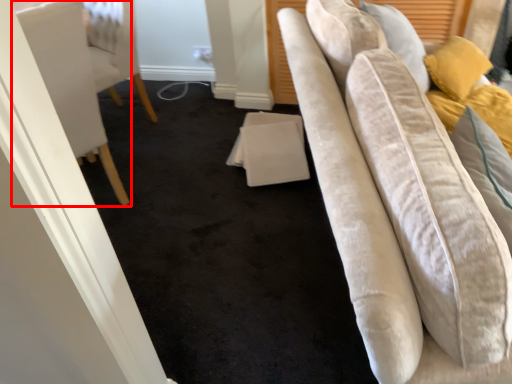
Question: Where is furniture (annotated by the red box) located in relation to table in the image?

Choices:
 (A) right
 (B) left

Answer: (B)